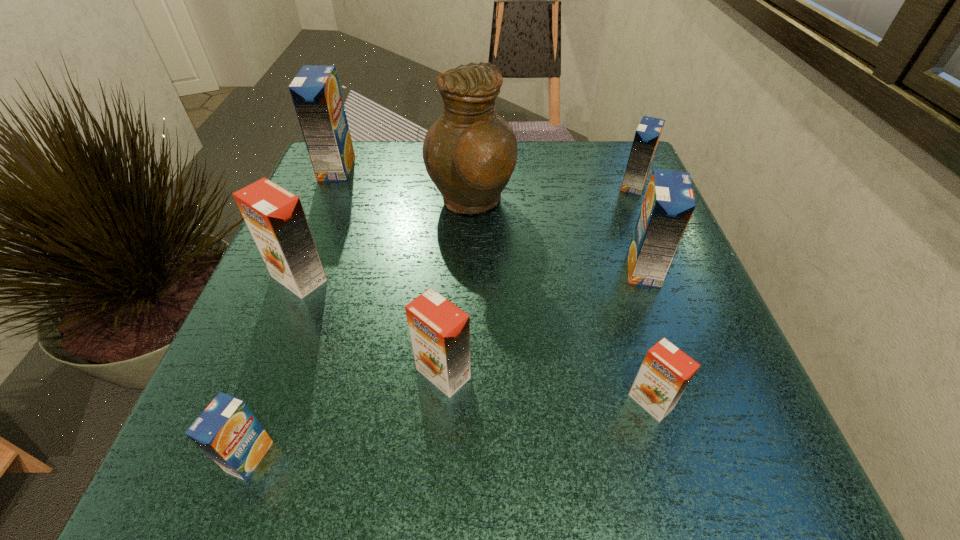
The image size is (960, 540). Find the location of `brown pitcher`. brown pitcher is located at coordinates (470, 152).

Where is `the tallest object`? This screenshot has height=540, width=960. the tallest object is located at coordinates (470, 152).

Locate an element on the screen. the second tallest object is located at coordinates (315, 91).

Locate an element on the screen. Image resolution: width=960 pixels, height=540 pixels. the biggest blue orange_juice is located at coordinates (315, 91).

Where is `the third smallest blue orange_juice`? The height and width of the screenshot is (540, 960). the third smallest blue orange_juice is located at coordinates [669, 202].

Locate an element on the screen. the farthest orange orange juice is located at coordinates (275, 217).

Identify the location of the biggest orange orange juice. (275, 217).

This screenshot has width=960, height=540. What are the coordinates of `the second smallest blue orange_juice` in the screenshot? It's located at (648, 133).

This screenshot has height=540, width=960. Identify the location of the second orange orange juice from right to left. (440, 331).

This screenshot has height=540, width=960. I want to click on the second smallest orange orange juice, so click(440, 331).